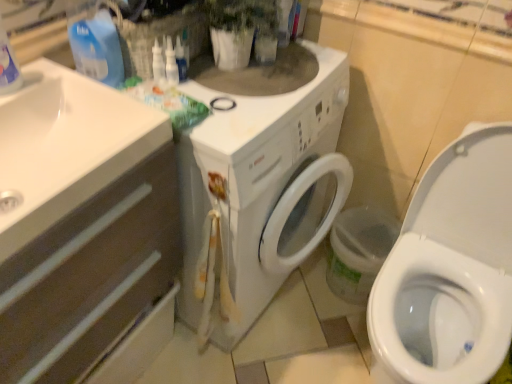
Question: Is blue plastic bottle at upper left positioned in front of white glossy sink at left?

Choices:
 (A) yes
 (B) no

Answer: (B)

Question: Does blue plastic bottle at upper left have a smaller size compared to white glossy sink at left?

Choices:
 (A) yes
 (B) no

Answer: (A)

Question: Is blue plastic bottle at upper left bigger than white glossy sink at left?

Choices:
 (A) yes
 (B) no

Answer: (B)

Question: Is blue plastic bottle at upper left positioned behind white glossy sink at left?

Choices:
 (A) yes
 (B) no

Answer: (A)

Question: Is blue plastic bottle at upper left at the left side of white glossy sink at left?

Choices:
 (A) yes
 (B) no

Answer: (B)

Question: From the image's perspective, is blue plastic bottle at upper left under white glossy sink at left?

Choices:
 (A) yes
 (B) no

Answer: (B)

Question: Is white glossy sink at left beside blue plastic bottle at upper left?

Choices:
 (A) yes
 (B) no

Answer: (B)

Question: From a real-world perspective, is white glossy sink at left below blue plastic bottle at upper left?

Choices:
 (A) no
 (B) yes

Answer: (B)

Question: Considering the relative positions of white glossy sink at left and blue plastic bottle at upper left in the image provided, is white glossy sink at left to the left of blue plastic bottle at upper left from the viewer's perspective?

Choices:
 (A) yes
 (B) no

Answer: (A)

Question: Is white glossy sink at left positioned with its back to blue plastic bottle at upper left?

Choices:
 (A) yes
 (B) no

Answer: (B)

Question: From the image's perspective, does white glossy sink at left appear higher than blue plastic bottle at upper left?

Choices:
 (A) yes
 (B) no

Answer: (B)

Question: Is white glossy sink at left smaller than blue plastic bottle at upper left?

Choices:
 (A) no
 (B) yes

Answer: (A)

Question: Considering the relative positions of blue plastic bottle at upper left and white matte drawer at left in the image provided, is blue plastic bottle at upper left behind white matte drawer at left?

Choices:
 (A) no
 (B) yes

Answer: (B)